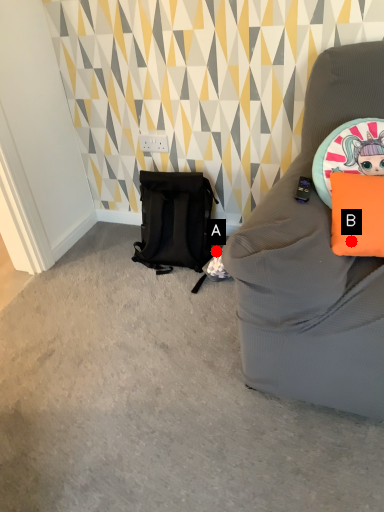
Question: Two points are circled on the image, labeled by A and B beside each circle. Among these points, which one is nearest to the camera?

Choices:
 (A) A is closer
 (B) B is closer

Answer: (B)